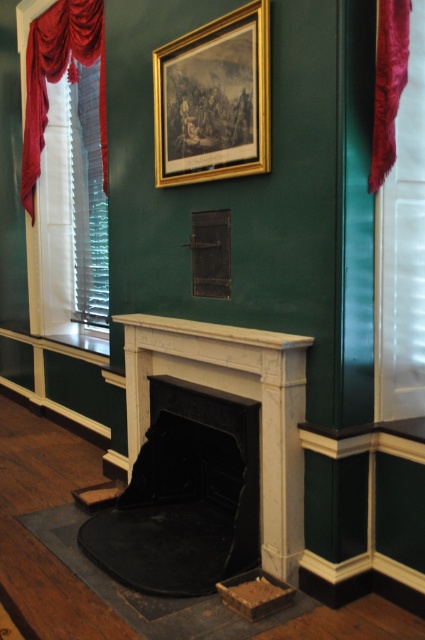
Question: Which point appears closest to the camera in this image?

Choices:
 (A) (241, 38)
 (B) (226, 476)
 (C) (376, 102)

Answer: (C)

Question: In this image, where is gold/gilded picture frame at upper center located relative to velvet deep red curtain at upper right?

Choices:
 (A) left
 (B) right

Answer: (A)

Question: Does velvet drapery at left have a smaller size compared to velvet deep red curtain at upper right?

Choices:
 (A) yes
 (B) no

Answer: (B)

Question: Is black marble fireplace at center thinner than velvet drapery at left?

Choices:
 (A) no
 (B) yes

Answer: (B)

Question: Which of these objects is positioned farthest from the black marble fireplace at center?

Choices:
 (A) gold/gilded picture frame at upper center
 (B) velvet deep red curtain at upper right

Answer: (B)

Question: Which point is farther from the camera taking this photo?

Choices:
 (A) (385, 145)
 (B) (141, 582)
 (C) (45, 17)
 (D) (161, 52)

Answer: (C)